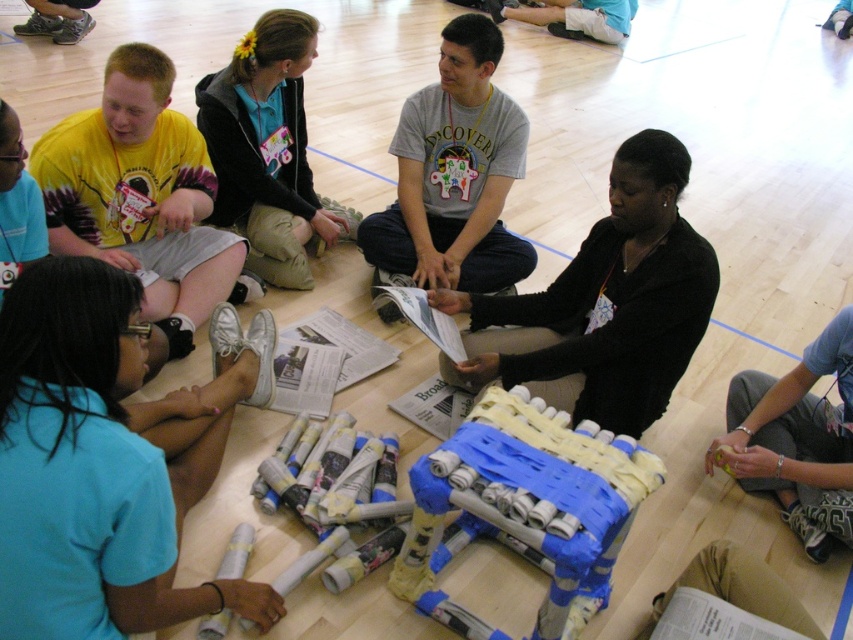
Does point (242, 184) come farther from viewer compared to point (836, 413)?

Yes, point (242, 184) is behind point (836, 413).

The height and width of the screenshot is (640, 853). Describe the element at coordinates (265, 148) in the screenshot. I see `black hoodie at center` at that location.

At what (x,y) coordinates should I click in order to perform the action: click on black hoodie at center. Please return your answer as a coordinate pair (x, y). This screenshot has width=853, height=640. Looking at the image, I should click on (265, 148).